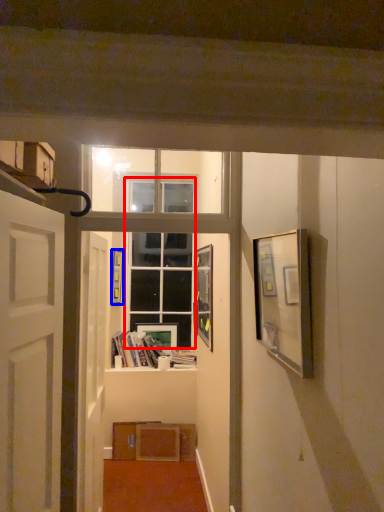
Question: Which object is further to the camera taking this photo, glass door (highlighted by a red box) or picture frame (highlighted by a blue box)?

Choices:
 (A) glass door
 (B) picture frame

Answer: (A)